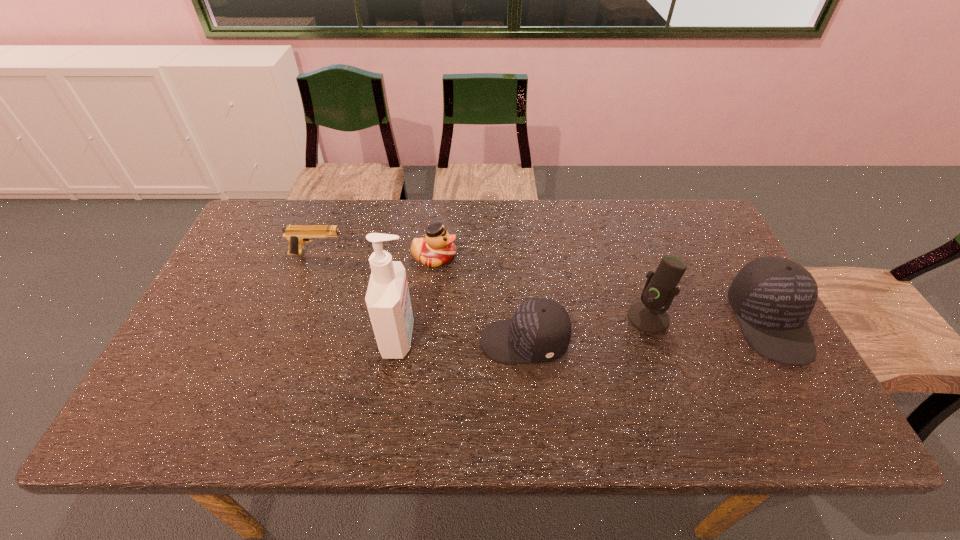
In order to click on the third object from right to left in this screenshot , I will do `click(540, 330)`.

I want to click on the left baseball cap, so click(x=540, y=330).

You are a GUI agent. You are given a task and a screenshot of the screen. Output one action in this format:
    pyautogui.click(x=<x>, y=<y>)
    Task: Click on the rightmost object
    This screenshot has height=540, width=960.
    Given the screenshot: What is the action you would take?
    pyautogui.click(x=772, y=297)

Find the location of `the right baseball cap`. the right baseball cap is located at coordinates (772, 297).

I want to click on duck, so click(x=437, y=248).

In order to click on the tallest object in this screenshot , I will do `click(388, 302)`.

In order to click on the shortest object in this screenshot , I will do `click(297, 235)`.

This screenshot has height=540, width=960. What are the coordinates of `pistol` in the screenshot? It's located at (297, 235).

Locate an element on the screen. the second object from right to left is located at coordinates (648, 316).

Locate an element on the screen. The image size is (960, 540). the fifth shortest object is located at coordinates (648, 316).